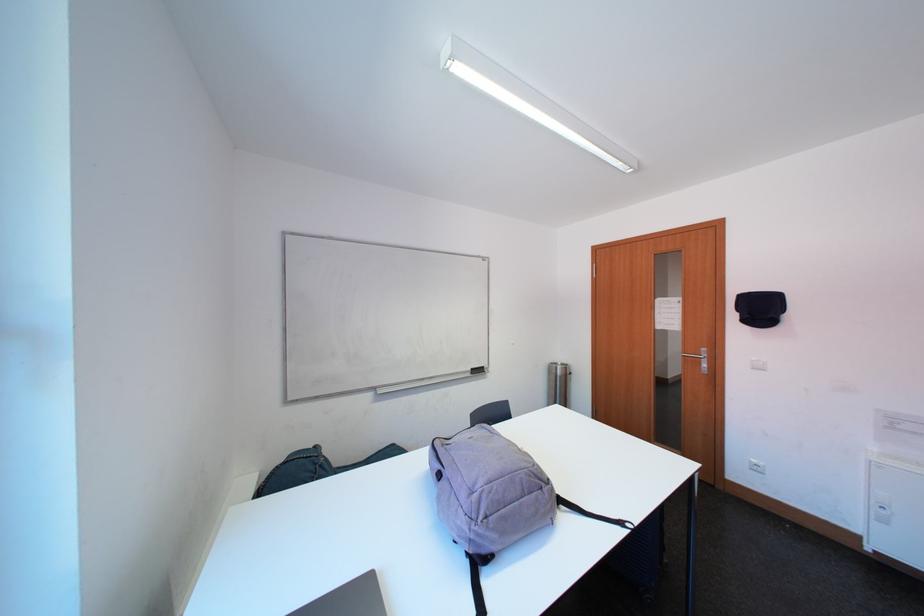
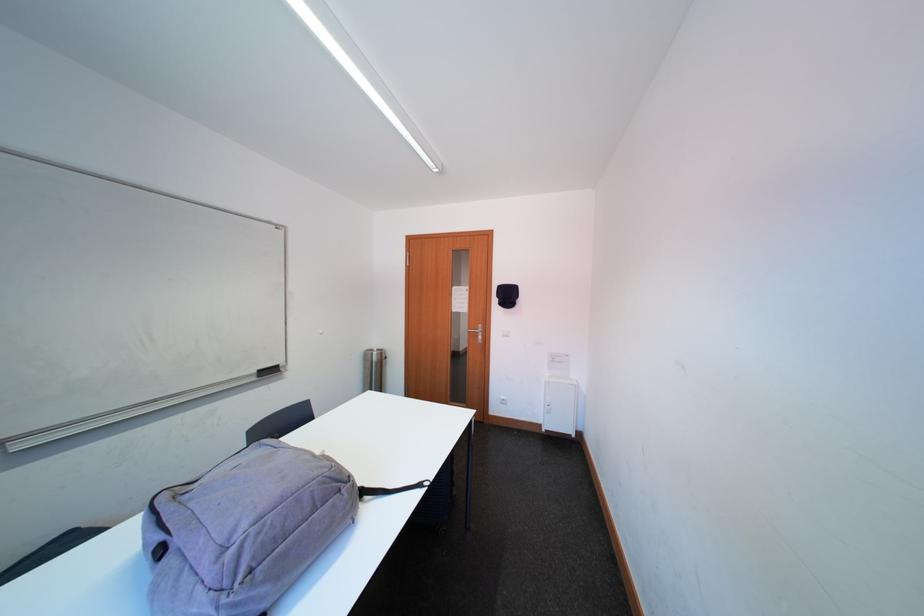
Find the pixel in the second image that matches (699,365) in the first image.

(481, 339)